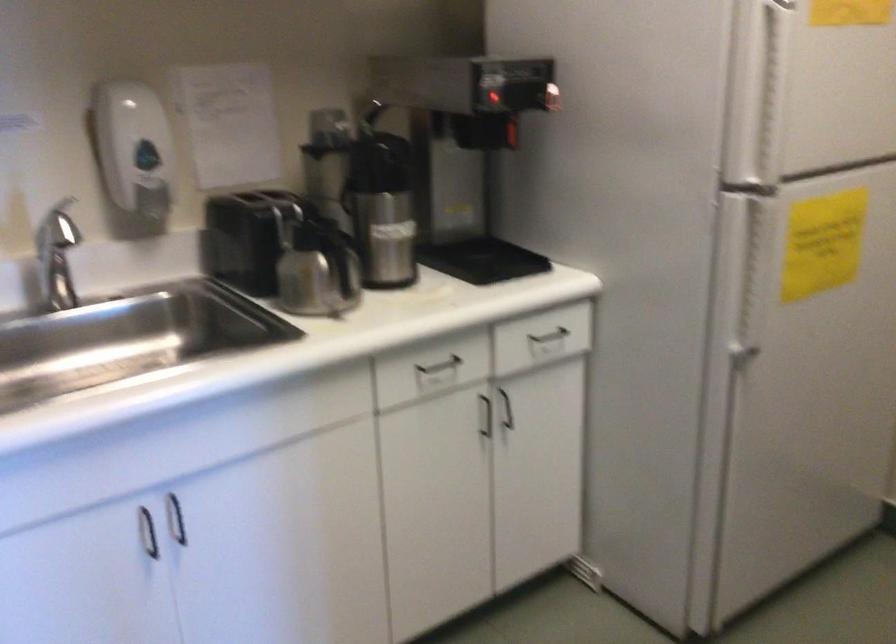
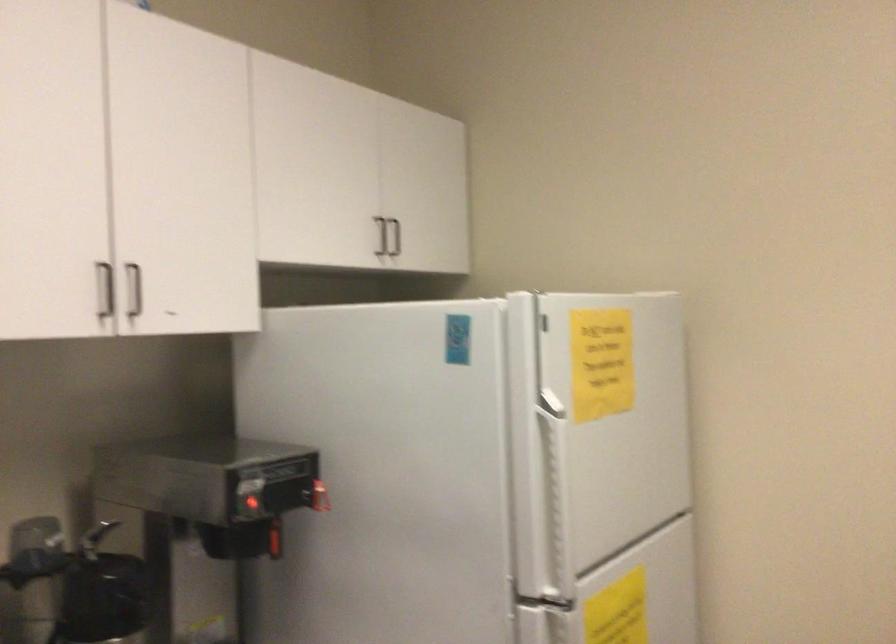
In the second image, find the point that corresponds to pixel 492 99 in the first image.

(250, 504)